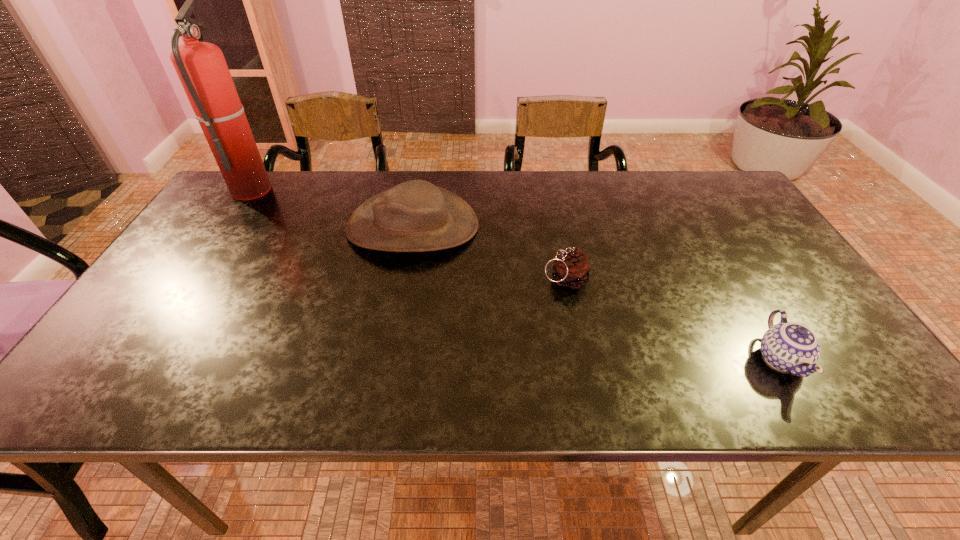
Identify the location of free point between the fire extinguisher and the cowboy hat. (332, 207).

Find the location of `unoccupied area between the pinecone and the rightmost object`. unoccupied area between the pinecone and the rightmost object is located at coordinates (673, 320).

Where is `vacant area that lies between the leftmost object and the second object from left to right`? The width and height of the screenshot is (960, 540). vacant area that lies between the leftmost object and the second object from left to right is located at coordinates (332, 207).

Identify which object is the third closest to the pinecone. Please provide its 2D coordinates. Your answer should be formatted as a tuple, i.e. [(x, y)], where the tuple contains the x and y coordinates of a point satisfying the conditions above.

[(201, 67)]

Point out which object is positioned as the third nearest to the third object from right to left. Please provide its 2D coordinates. Your answer should be formatted as a tuple, i.e. [(x, y)], where the tuple contains the x and y coordinates of a point satisfying the conditions above.

[(790, 347)]

The height and width of the screenshot is (540, 960). What are the coordinates of `vacant area that satisfies the following two spatial constraints: 1. with the nozzle and gauge on the second object from left to right; 2. on the right side of the leftmost object` in the screenshot? It's located at (227, 226).

Find the location of a particular element. This screenshot has height=540, width=960. vacant region that satisfies the following two spatial constraints: 1. with the nozzle and gauge on the second object from left to right; 2. on the right side of the tallest object is located at coordinates point(227,226).

You are a GUI agent. You are given a task and a screenshot of the screen. Output one action in this format:
    pyautogui.click(x=<x>, y=<y>)
    Task: Click on the vacant space that satisfies the following two spatial constraints: 1. with the nozzle and gauge on the cowboy hat; 2. on the right side of the tallest object
    The image size is (960, 540).
    Given the screenshot: What is the action you would take?
    pyautogui.click(x=227, y=226)

Image resolution: width=960 pixels, height=540 pixels. Find the location of `free spot that satisfies the following two spatial constraints: 1. on the back side of the second object from left to right; 2. with the nozzle and gauge on the tallest object`. free spot that satisfies the following two spatial constraints: 1. on the back side of the second object from left to right; 2. with the nozzle and gauge on the tallest object is located at coordinates (420, 188).